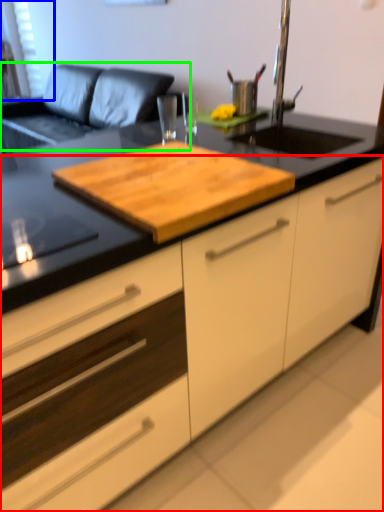
Question: Which object is the farthest from cabinetry (highlighted by a red box)? Choose among these: window screen (highlighted by a blue box) or couch (highlighted by a green box).

Choices:
 (A) window screen
 (B) couch

Answer: (A)